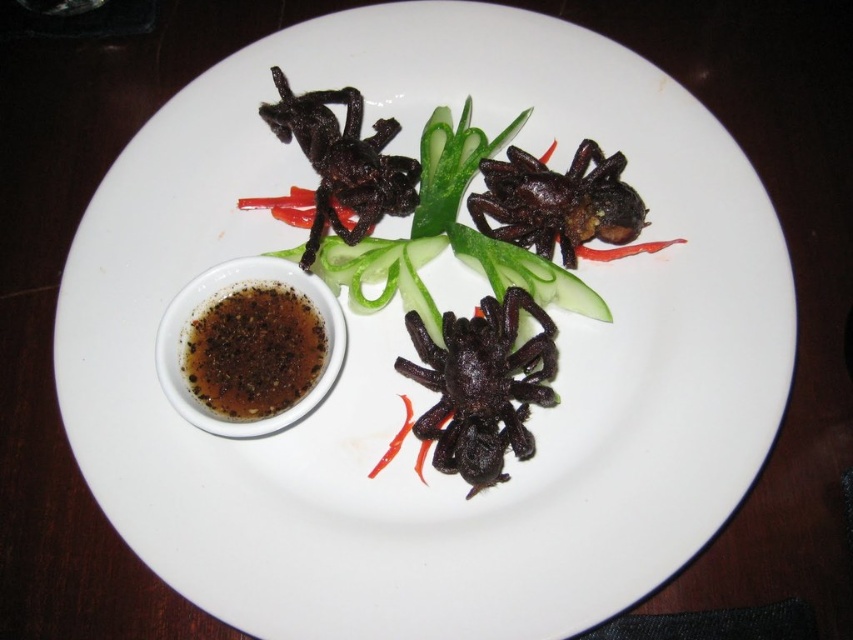
You are a food critic who needs to dip the shiny black spider at upper center into the brown glossy sauce at lower left. Can you reach the sauce without moving the spider?

The brown glossy sauce at lower left is closer to the viewer than the shiny black spider at upper center, so you can easily reach the sauce without moving the spider.

You are a food critic evaluating this dish. You need to describe the size comparison between the black crispy spider at center and the shiny black spider at upper center. Which one is larger?

The black crispy spider at center is bigger than the shiny black spider at upper center.